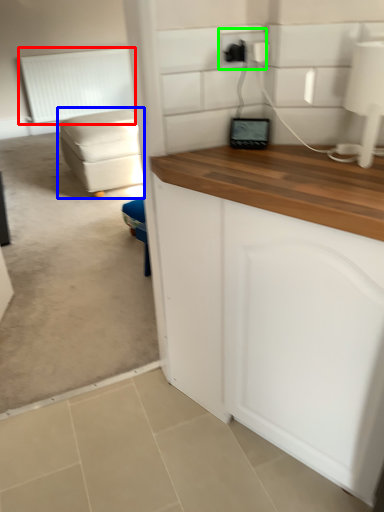
Question: Estimate the real-world distances between objects in this image. Which object is farther from radiator (highlighted by a red box), studio couch (highlighted by a blue box) or electric outlet (highlighted by a green box)?

Choices:
 (A) studio couch
 (B) electric outlet

Answer: (B)